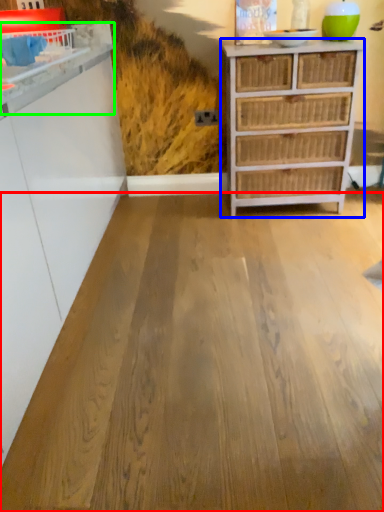
Question: Which is farther away from plywood (highlighted by a red box)? chest of drawers (highlighted by a blue box) or counter (highlighted by a green box)?

Choices:
 (A) chest of drawers
 (B) counter

Answer: (B)